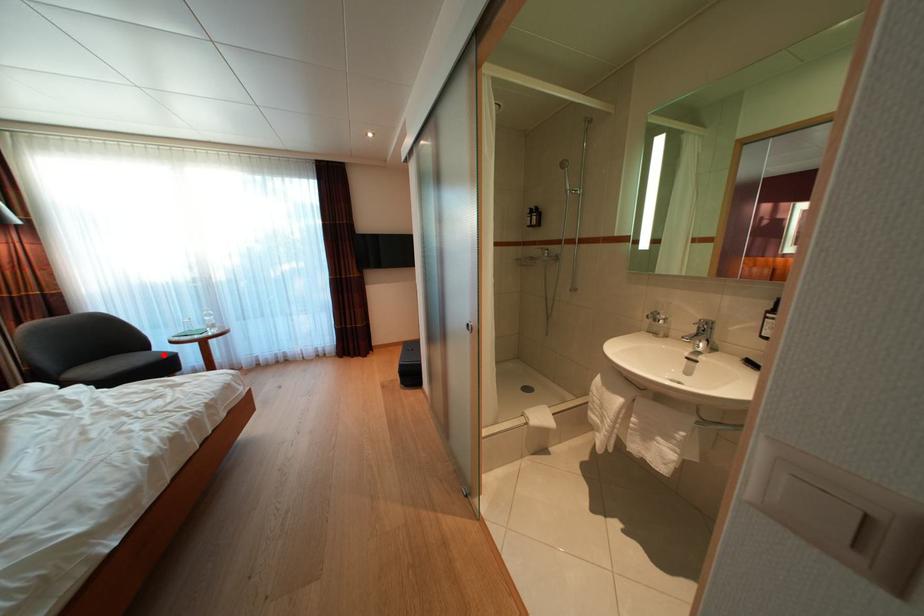
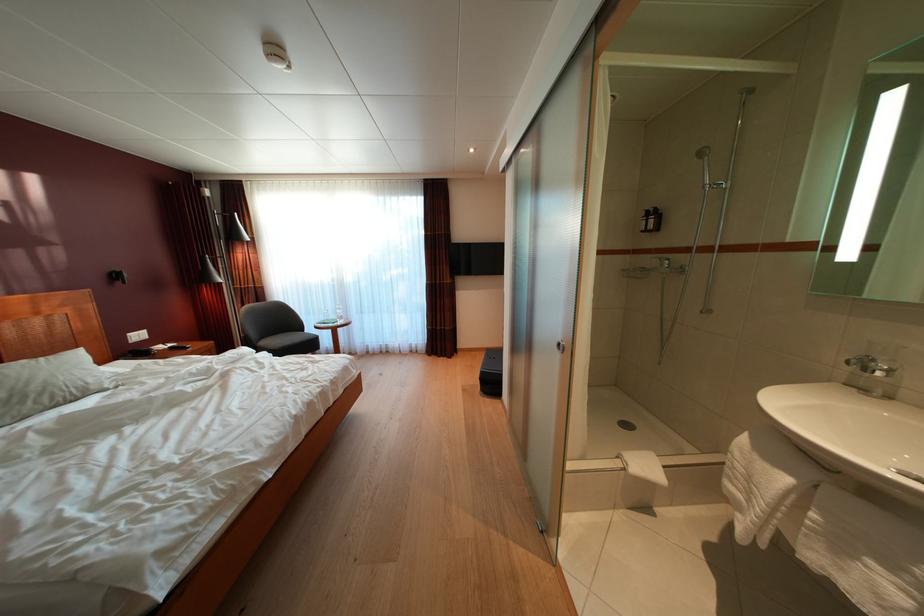
Where in the second image is the point corresponding to the highlighted location from the first image?

(314, 337)